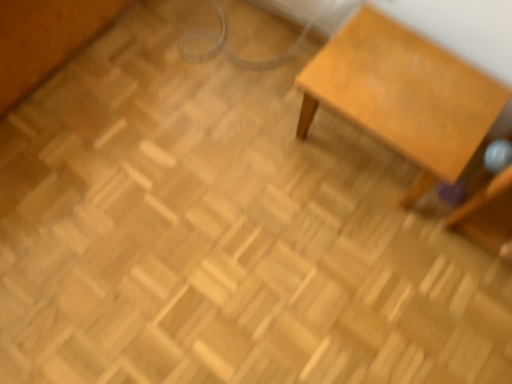
Where is `free space in front of light brown wooden table at upper right`? free space in front of light brown wooden table at upper right is located at coordinates coord(369,253).